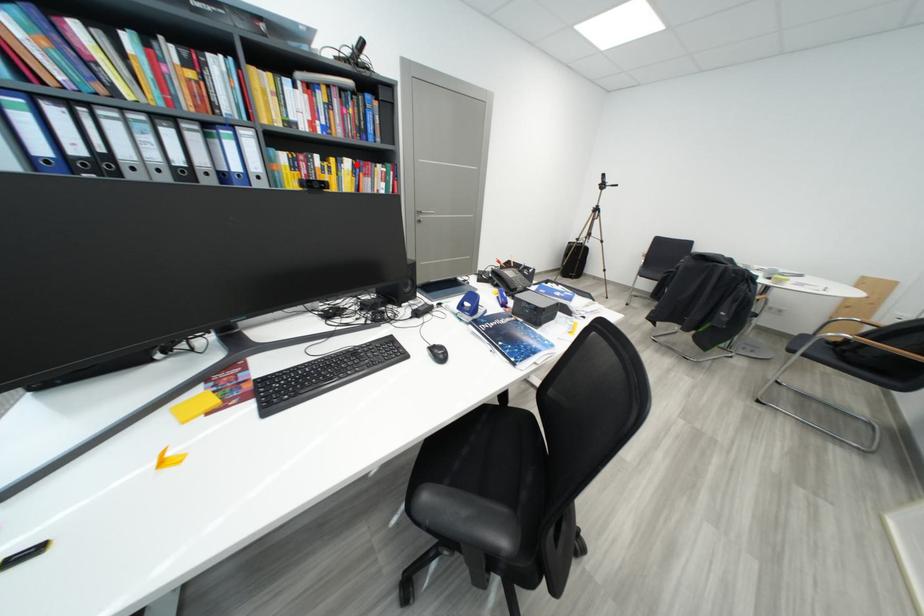
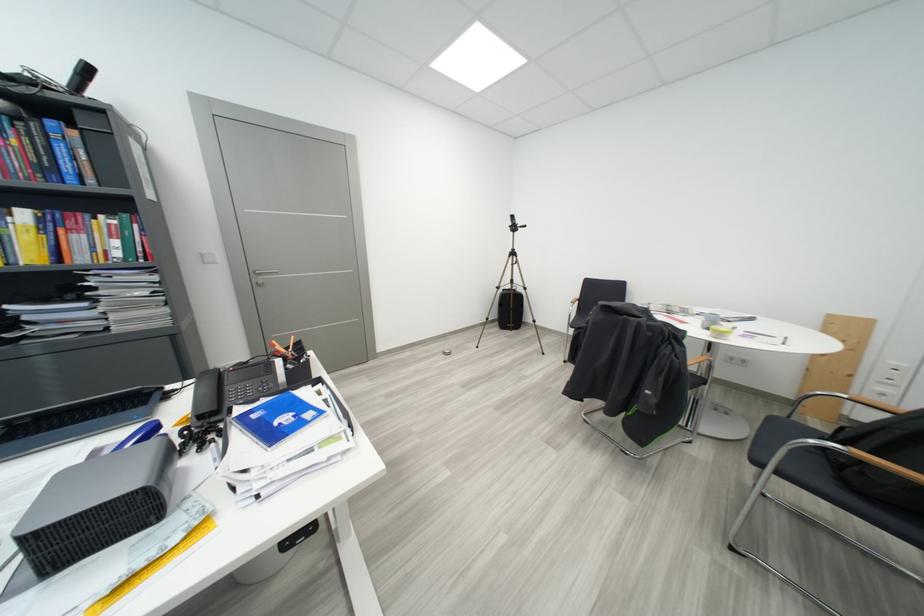
Question: I am providing you with two images of the same scene from different viewpoints. In image1, a red point is highlighted. Considering the same 3D point in image2, which of the following is correct?

Choices:
 (A) It is closer
 (B) It is farther

Answer: (B)